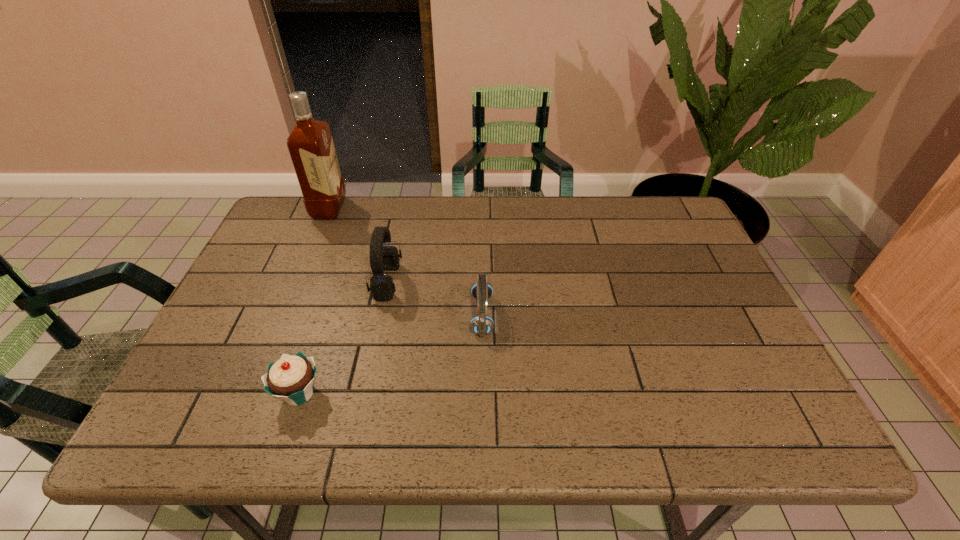
The image size is (960, 540). Identify the location of free space located 0.290m on the right of the cupcake. (461, 393).

You are a GUI agent. You are given a task and a screenshot of the screen. Output one action in this format:
    pyautogui.click(x=<x>, y=<y>)
    Task: Click on the vacant space situated on the ear cups of the right headset
    This screenshot has width=960, height=540.
    Given the screenshot: What is the action you would take?
    pyautogui.click(x=435, y=315)

You are a GUI agent. You are given a task and a screenshot of the screen. Output one action in this format:
    pyautogui.click(x=<x>, y=<y>)
    Task: Click on the vacant region located 0.390m on the ear cups of the right headset
    This screenshot has height=540, width=960.
    Given the screenshot: What is the action you would take?
    pyautogui.click(x=314, y=315)

At what (x,y) coordinates should I click in order to perform the action: click on vacant space located on the ear cups of the right headset. Please return your answer as a coordinate pair (x, y). The width and height of the screenshot is (960, 540). Looking at the image, I should click on (343, 315).

This screenshot has width=960, height=540. Find the location of `object located in the far edge section of the desktop`. object located in the far edge section of the desktop is located at coordinates 310,144.

Identify the location of object that is at the near edge. This screenshot has height=540, width=960. (291, 378).

Identify the location of object that is at the left edge. (310, 144).

Identify the location of object present at the far left corner. pyautogui.click(x=310, y=144).

At what (x,y) coordinates should I click in order to perform the action: click on vacant space at the far edge of the desktop. Please return your answer as a coordinate pair (x, y). The image size is (960, 540). Looking at the image, I should click on (368, 229).

This screenshot has height=540, width=960. I want to click on vacant space at the near edge of the desktop, so click(x=446, y=428).